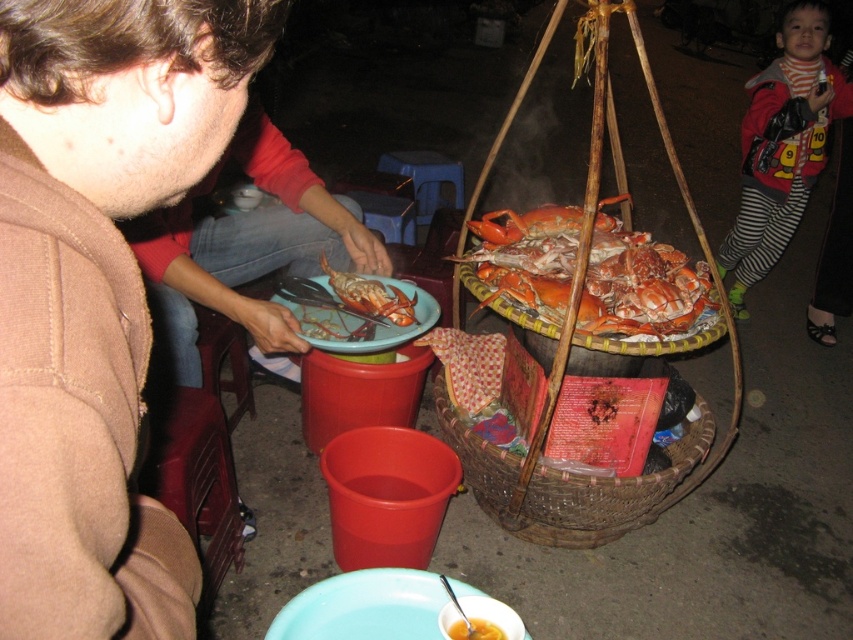
Question: Is brown woolen sweater at upper left in front of orange shell crabs at center?

Choices:
 (A) no
 (B) yes

Answer: (B)

Question: Is striped leggings at lower right bigger than matte blue plate at center?

Choices:
 (A) no
 (B) yes

Answer: (B)

Question: Among these objects, which one is farthest from the camera?

Choices:
 (A) striped leggings at lower right
 (B) matte blue plate at center

Answer: (A)

Question: Which point is closer to the camera?

Choices:
 (A) (416, 289)
 (B) (735, 269)

Answer: (A)

Question: Can you confirm if woven brown basket at lower center is positioned above yellow matte soup at lower center?

Choices:
 (A) yes
 (B) no

Answer: (A)

Question: Which point is closer to the camera taking this photo?

Choices:
 (A) (125, 88)
 (B) (496, 628)
 (C) (639, 317)

Answer: (A)